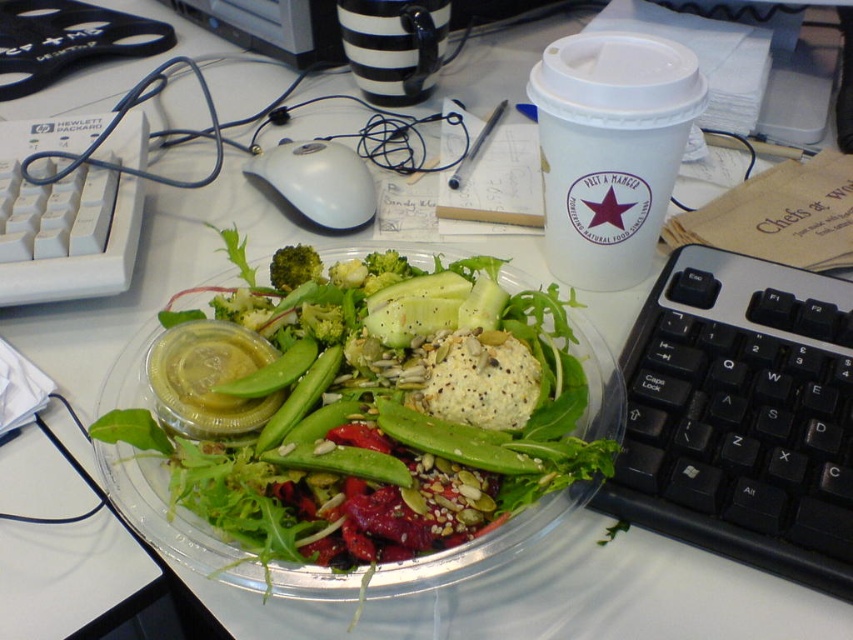
Is translucent plastic salad at center further to camera compared to black plastic keyboard at lower right?

No, it is not.

Between point (349, 406) and point (651, 458), which one is positioned in front?

Point (651, 458) is more forward.

Between point (450, 371) and point (668, 444), which one is positioned behind?

Positioned behind is point (668, 444).

Locate an element on the screen. translucent plastic salad at center is located at coordinates (354, 442).

Does translucent plastic salad at center have a greater height compared to green matte broccoli at center?

Indeed, translucent plastic salad at center has a greater height compared to green matte broccoli at center.

Is translucent plastic salad at center closer to camera compared to green matte broccoli at center?

Yes, it is in front of green matte broccoli at center.

Which is in front, point (527, 493) or point (270, 273)?

Point (527, 493) is in front.

Where is `translucent plastic salad at center`? translucent plastic salad at center is located at coordinates (354, 442).

Is green leafy broccoli at center below green broccoli at center?

Yes, green leafy broccoli at center is below green broccoli at center.

Who is positioned more to the left, green leafy broccoli at center or green broccoli at center?

green leafy broccoli at center is more to the left.

Does point (332, 305) come in front of point (409, 266)?

Yes, it is.

Find the location of a particular element. This screenshot has height=640, width=853. green leafy broccoli at center is located at coordinates (322, 323).